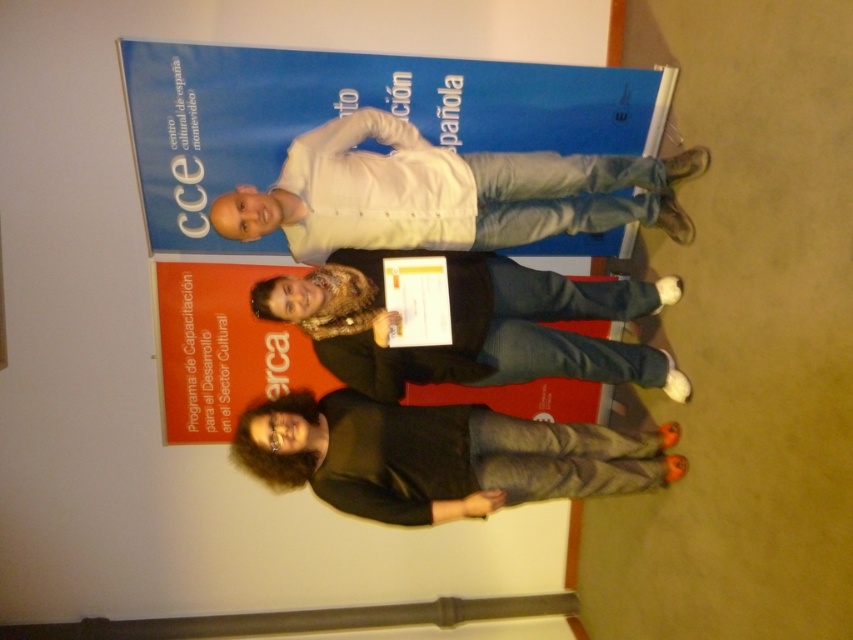
Is white matte shirt at center to the right of matte black sweater at center from the viewer's perspective?

Incorrect, white matte shirt at center is not on the right side of matte black sweater at center.

Between white matte shirt at center and matte black sweater at center, which one appears on the left side from the viewer's perspective?

white matte shirt at center is more to the left.

Is point (607, 227) positioned in front of point (351, 346)?

That is False.

Identify the location of white matte shirt at center. The height and width of the screenshot is (640, 853). (444, 193).

Is the position of black matte shirt at lower center less distant than that of matte black sweater at center?

That is False.

Is black matte shirt at lower center positioned behind matte black sweater at center?

Yes.

Between point (318, 472) and point (334, 292), which one is positioned in front?

Point (334, 292) is in front.

This screenshot has width=853, height=640. I want to click on black matte shirt at lower center, so click(x=440, y=456).

Describe the element at coordinates (444, 193) in the screenshot. I see `white matte shirt at center` at that location.

Is white matte shirt at center thinner than black matte shirt at lower center?

No.

This screenshot has width=853, height=640. What do you see at coordinates (444, 193) in the screenshot? I see `white matte shirt at center` at bounding box center [444, 193].

At what (x,y) coordinates should I click in order to perform the action: click on white matte shirt at center. Please return your answer as a coordinate pair (x, y). Looking at the image, I should click on (444, 193).